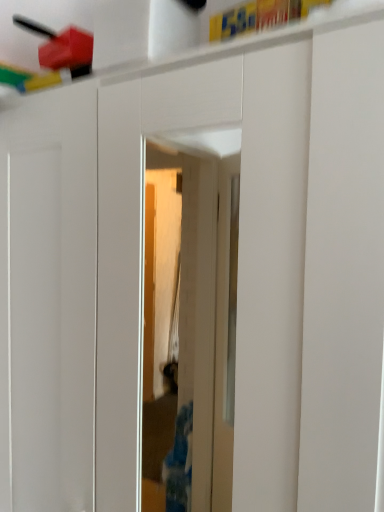
Question: Should I look upward or downward to see rubberized red block at upper left?

Choices:
 (A) up
 (B) down

Answer: (A)